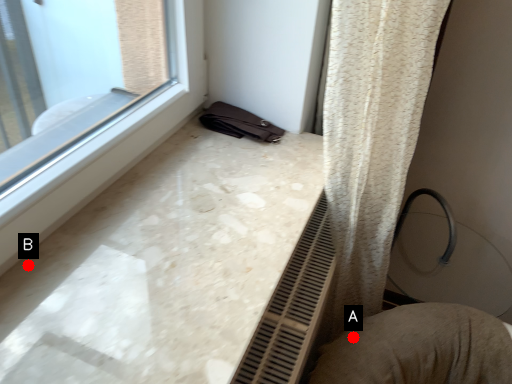
Question: Two points are circled on the image, labeled by A and B beside each circle. Among these points, which one is farthest from the camera?

Choices:
 (A) A is further
 (B) B is further

Answer: (A)